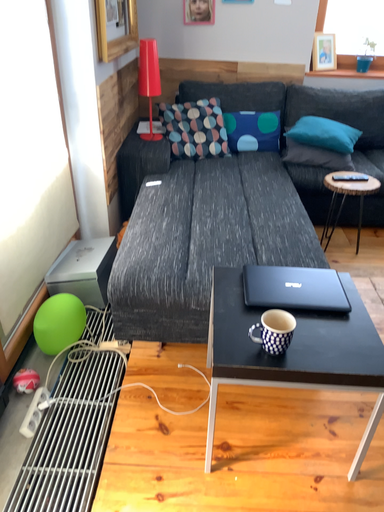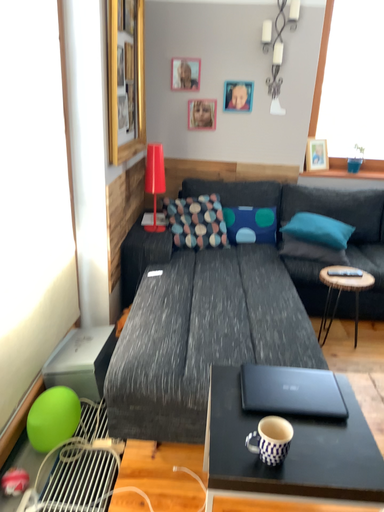
Question: How did the camera likely rotate when shooting the video?

Choices:
 (A) rotated upward
 (B) rotated downward

Answer: (A)